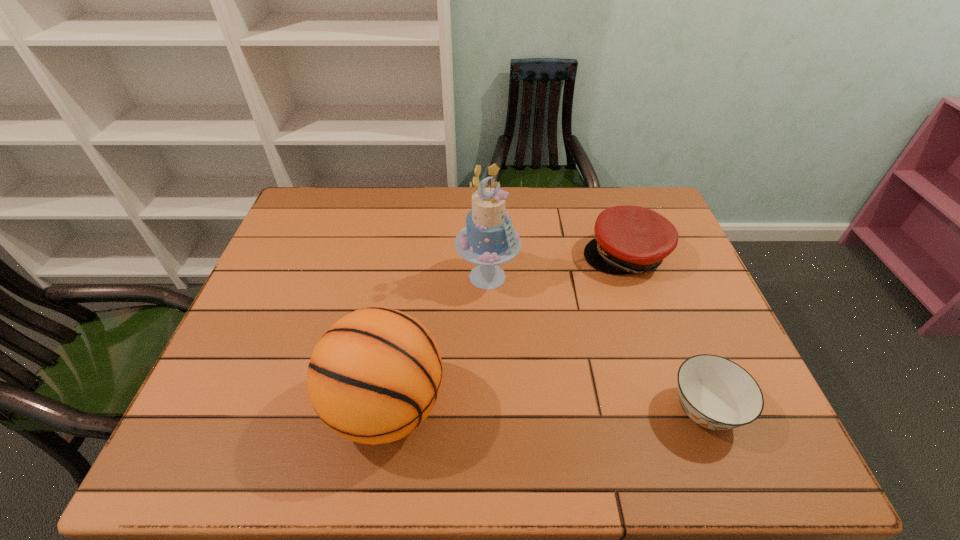
At what (x,y) coordinates should I click in order to perform the action: click on vacant space at the left edge of the desktop. Please return your answer as a coordinate pair (x, y). The width and height of the screenshot is (960, 540). Looking at the image, I should click on (315, 247).

Locate an element on the screen. vacant area at the right edge is located at coordinates (681, 305).

Where is `vacant space at the far left corner of the desktop`? The image size is (960, 540). vacant space at the far left corner of the desktop is located at coordinates (334, 197).

Identify the location of free space that is in between the shortest object and the second tallest object. Image resolution: width=960 pixels, height=540 pixels. (545, 409).

Locate an element on the screen. free space between the third shortest object and the shortest object is located at coordinates (545, 409).

The width and height of the screenshot is (960, 540). Find the location of `vacant space that is in between the basketball and the cap`. vacant space that is in between the basketball and the cap is located at coordinates (506, 332).

Image resolution: width=960 pixels, height=540 pixels. What are the coordinates of `vacant space that's between the third shortest object and the tallest object` in the screenshot? It's located at (437, 342).

Identify the location of vacant region between the cake and the basketball. (437, 342).

Image resolution: width=960 pixels, height=540 pixels. In order to click on free space that is in between the leftmost object and the cake in this screenshot , I will do `click(437, 342)`.

I want to click on unoccupied position between the tallest object and the second shortest object, so click(557, 266).